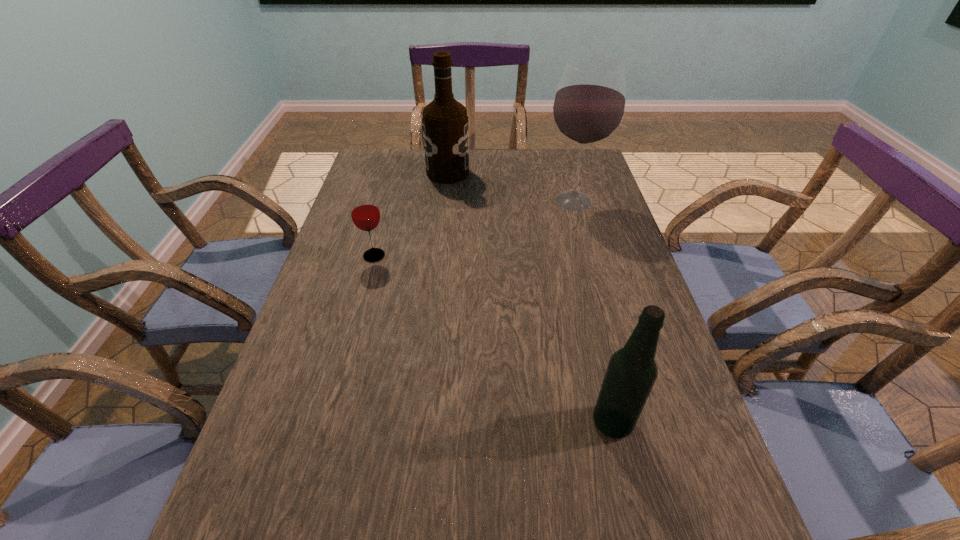
You are a GUI agent. You are given a task and a screenshot of the screen. Output one action in this format:
    pyautogui.click(x=<x>, y=<y>)
    Task: Click on the third nearest object
    This screenshot has width=960, height=540.
    Given the screenshot: What is the action you would take?
    pyautogui.click(x=589, y=105)

The image size is (960, 540). I want to click on the farthest object, so click(445, 122).

Where is `the second object from left to right`? The image size is (960, 540). the second object from left to right is located at coordinates (445, 122).

The height and width of the screenshot is (540, 960). What are the coordinates of `the nearest object` in the screenshot? It's located at (631, 373).

Locate an element on the screen. This screenshot has height=540, width=960. the shortest alcohol is located at coordinates (631, 373).

In order to click on glass in this screenshot , I will do `click(365, 214)`.

Find the location of `the second nearest object`. the second nearest object is located at coordinates (365, 214).

Locate an element on the screen. The width and height of the screenshot is (960, 540). vacant space located 0.090m on the left of the second nearest alcohol is located at coordinates (513, 201).

You are a GUI agent. You are given a task and a screenshot of the screen. Output one action in this format:
    pyautogui.click(x=<x>, y=<y>)
    Task: Click on the vacant space located on the label of the leftmost alcohol
    This screenshot has height=540, width=960.
    Given the screenshot: What is the action you would take?
    pyautogui.click(x=543, y=173)

This screenshot has width=960, height=540. Find the location of `free space located on the right of the shortest alcohol`. free space located on the right of the shortest alcohol is located at coordinates (686, 422).